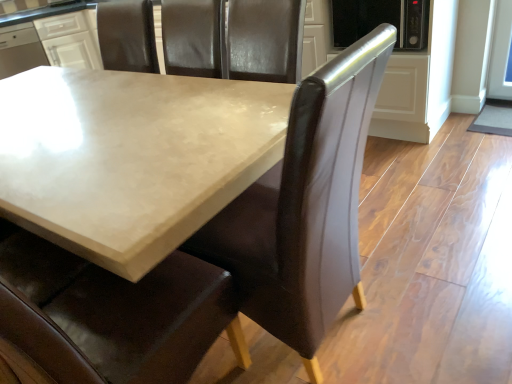
Question: Is matte concrete table at center smaller than brown leather chair at center?

Choices:
 (A) no
 (B) yes

Answer: (B)

Question: Is matte concrete table at center outside brown leather chair at center?

Choices:
 (A) yes
 (B) no

Answer: (A)

Question: Considering the relative positions of matte concrete table at center and brown leather chair at center in the image provided, is matte concrete table at center to the left of brown leather chair at center from the viewer's perspective?

Choices:
 (A) no
 (B) yes

Answer: (B)

Question: From the image's perspective, is matte concrete table at center below brown leather chair at center?

Choices:
 (A) no
 (B) yes

Answer: (B)

Question: Is matte concrete table at center positioned with its back to brown leather chair at center?

Choices:
 (A) no
 (B) yes

Answer: (A)

Question: Does matte concrete table at center appear on the right side of brown leather chair at center?

Choices:
 (A) no
 (B) yes

Answer: (A)

Question: Is brown leather chair at center touching matte concrete table at center?

Choices:
 (A) no
 (B) yes

Answer: (A)

Question: Is brown leather chair at center not near matte concrete table at center?

Choices:
 (A) yes
 (B) no

Answer: (B)

Question: Is matte concrete table at center surrounded by brown leather chair at center?

Choices:
 (A) yes
 (B) no

Answer: (B)

Question: Is brown leather chair at center not within matte concrete table at center?

Choices:
 (A) yes
 (B) no

Answer: (A)

Question: Does brown leather chair at center have a greater height compared to matte concrete table at center?

Choices:
 (A) no
 (B) yes

Answer: (A)

Question: From a real-world perspective, is brown leather chair at center on matte concrete table at center?

Choices:
 (A) no
 (B) yes

Answer: (A)

Question: Is white glossy cabinet at upper left aimed at matte concrete table at center?

Choices:
 (A) no
 (B) yes

Answer: (B)